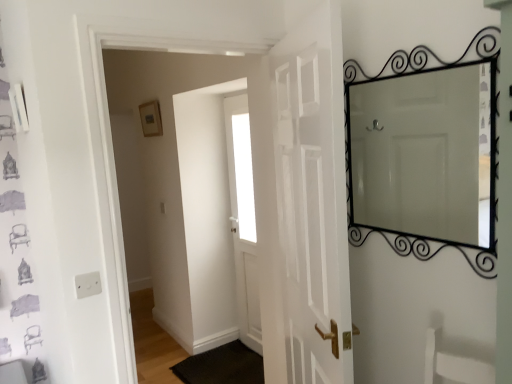
Image resolution: width=512 pixels, height=384 pixels. What do you see at coordinates (243, 219) in the screenshot? I see `white matte door at center, arranged as the 2th door when viewed from the front` at bounding box center [243, 219].

Measure the distance between point [469,153] and camera.

The depth of point [469,153] is 1.65 meters.

The width and height of the screenshot is (512, 384). I want to click on black rubber doormat at lower center, so click(x=222, y=366).

What's the angular difference between matte gold picture frame at upper center and black wrought iron mirror at upper right's facing directions?

0.0639 degrees.

Is matte gold picture frame at upper center next to black wrought iron mirror at upper right and touching it?

matte gold picture frame at upper center is not next to black wrought iron mirror at upper right, and they're not touching.

In the scene shown: Does matte gold picture frame at upper center turn towards black wrought iron mirror at upper right?

No, matte gold picture frame at upper center is not aimed at black wrought iron mirror at upper right.

The image size is (512, 384). Find the location of `picture frame above the black wrought iron mirror at upper right (from a real-world perspective)`. picture frame above the black wrought iron mirror at upper right (from a real-world perspective) is located at coordinates [151, 119].

Could you tell me if black rubber doormat at lower center is turned towards white glossy door at center, the first door in the front-to-back sequence?

No, black rubber doormat at lower center is not turned towards white glossy door at center, the first door in the front-to-back sequence.

In terms of width, does black rubber doormat at lower center look wider or thinner when compared to white glossy door at center, positioned as the second door in back-to-front order?

black rubber doormat at lower center is wider than white glossy door at center, positioned as the second door in back-to-front order.

Does black rubber doormat at lower center have a lesser height compared to white glossy door at center, positioned as the second door in back-to-front order?

Indeed, black rubber doormat at lower center has a lesser height compared to white glossy door at center, positioned as the second door in back-to-front order.

Do you think white matte door at center, arranged as the 2th door when viewed from the front, is within white glossy door at center, the first door in the front-to-back sequence, or outside of it?

white matte door at center, arranged as the 2th door when viewed from the front, is located beyond the bounds of white glossy door at center, the first door in the front-to-back sequence.

Considering the sizes of white matte door at center, the first door in the back-to-front sequence, and white glossy door at center, the first door in the front-to-back sequence, in the image, is white matte door at center, the first door in the back-to-front sequence, taller or shorter than white glossy door at center, the first door in the front-to-back sequence,?

Clearly, white matte door at center, the first door in the back-to-front sequence, is taller compared to white glossy door at center, the first door in the front-to-back sequence.

Does point (236, 110) come in front of point (331, 236)?

No, (236, 110) is further to viewer.

Is black wrought iron mirror at upper right far away from white matte door at center, arranged as the 2th door when viewed from the front?

black wrought iron mirror at upper right is far away from white matte door at center, arranged as the 2th door when viewed from the front.

Consider the image. Considering the sizes of black wrought iron mirror at upper right and white matte door at center, the first door in the back-to-front sequence, in the image, is black wrought iron mirror at upper right bigger or smaller than white matte door at center, the first door in the back-to-front sequence,?

black wrought iron mirror at upper right is smaller than white matte door at center, the first door in the back-to-front sequence.

Based on the photo, would you say black wrought iron mirror at upper right contains white matte door at center, the first door in the back-to-front sequence?

Actually, white matte door at center, the first door in the back-to-front sequence, is outside black wrought iron mirror at upper right.

Is black wrought iron mirror at upper right thinner than white matte door at center, the first door in the back-to-front sequence?

Yes.

From the image's perspective, does black rubber doormat at lower center appear lower than matte gold picture frame at upper center?

Yes, from the image's perspective, black rubber doormat at lower center is beneath matte gold picture frame at upper center.

Is matte gold picture frame at upper center at the back of black rubber doormat at lower center?

No, black rubber doormat at lower center's orientation is not away from matte gold picture frame at upper center.

Is black rubber doormat at lower center not within matte gold picture frame at upper center?

Yes, black rubber doormat at lower center is not within matte gold picture frame at upper center.

Can you confirm if black rubber doormat at lower center is bigger than matte gold picture frame at upper center?

Indeed, black rubber doormat at lower center has a larger size compared to matte gold picture frame at upper center.

From the image's perspective, which one is positioned higher, matte gold picture frame at upper center or white matte door at center, the first door in the back-to-front sequence?

matte gold picture frame at upper center, from the image's perspective.

Is matte gold picture frame at upper center facing away from white matte door at center, arranged as the 2th door when viewed from the front?

No, matte gold picture frame at upper center is not facing the opposite direction of white matte door at center, arranged as the 2th door when viewed from the front.

From a real-world perspective, is matte gold picture frame at upper center over white matte door at center, the first door in the back-to-front sequence?

Yes.

Is point (317, 97) farther from viewer compared to point (259, 308)?

No, it is not.

Considering the relative sizes of white glossy door at center, positioned as the second door in back-to-front order, and white matte door at center, arranged as the 2th door when viewed from the front, in the image provided, is white glossy door at center, positioned as the second door in back-to-front order, bigger than white matte door at center, arranged as the 2th door when viewed from the front,?

Correct, white glossy door at center, positioned as the second door in back-to-front order, is larger in size than white matte door at center, arranged as the 2th door when viewed from the front.

Is white glossy door at center, the first door in the front-to-back sequence, far from white matte door at center, arranged as the 2th door when viewed from the front?

That's right, there is a large distance between white glossy door at center, the first door in the front-to-back sequence, and white matte door at center, arranged as the 2th door when viewed from the front.

What's the angular difference between white glossy door at center, the first door in the front-to-back sequence, and white matte door at center, arranged as the 2th door when viewed from the front,'s facing directions?

25.2 degrees separate the facing orientations of white glossy door at center, the first door in the front-to-back sequence, and white matte door at center, arranged as the 2th door when viewed from the front.

Where is `picture frame that appears above the black wrought iron mirror at upper right (from the image's perspective)`? The image size is (512, 384). picture frame that appears above the black wrought iron mirror at upper right (from the image's perspective) is located at coordinates (151, 119).

At what (x,y) coordinates should I click in order to perform the action: click on the 2nd door counting from the right side of the black rubber doormat at lower center. Please return your answer as a coordinate pair (x, y). Looking at the image, I should click on (306, 208).

From the image, which object appears to be nearer to white matte door at center, the first door in the back-to-front sequence, matte gold picture frame at upper center or white glossy door at center, the first door in the front-to-back sequence?

matte gold picture frame at upper center is closer to white matte door at center, the first door in the back-to-front sequence.

Considering their positions, is matte gold picture frame at upper center positioned closer to white matte door at center, arranged as the 2th door when viewed from the front, than black wrought iron mirror at upper right?

matte gold picture frame at upper center.

From the image, which object appears to be nearer to white matte door at center, arranged as the 2th door when viewed from the front, black wrought iron mirror at upper right or white glossy door at center, the first door in the front-to-back sequence?

white glossy door at center, the first door in the front-to-back sequence.

From the image, which object appears to be nearer to matte gold picture frame at upper center, black wrought iron mirror at upper right or white glossy door at center, the first door in the front-to-back sequence?

Based on the image, white glossy door at center, the first door in the front-to-back sequence, appears to be nearer to matte gold picture frame at upper center.

Which object lies further to the anchor point black wrought iron mirror at upper right, black rubber doormat at lower center or white matte door at center, the first door in the back-to-front sequence?

black rubber doormat at lower center is further to black wrought iron mirror at upper right.

From the image, which object appears to be farther from black rubber doormat at lower center, black wrought iron mirror at upper right or matte gold picture frame at upper center?

black wrought iron mirror at upper right is further to black rubber doormat at lower center.

From the image, which object appears to be farther from white glossy door at center, positioned as the second door in back-to-front order, black wrought iron mirror at upper right or matte gold picture frame at upper center?

Among the two, matte gold picture frame at upper center is located further to white glossy door at center, positioned as the second door in back-to-front order.

When comparing their distances from white glossy door at center, the first door in the front-to-back sequence, does white matte door at center, the first door in the back-to-front sequence, or matte gold picture frame at upper center seem closer?

The object closer to white glossy door at center, the first door in the front-to-back sequence, is white matte door at center, the first door in the back-to-front sequence.

Where is `doormat between black wrought iron mirror at upper right and white matte door at center, arranged as the 2th door when viewed from the front, along the z-axis`? doormat between black wrought iron mirror at upper right and white matte door at center, arranged as the 2th door when viewed from the front, along the z-axis is located at coordinates (222, 366).

At what (x,y) coordinates should I click in order to perform the action: click on mirror between white glossy door at center, positioned as the second door in back-to-front order, and black rubber doormat at lower center, along the z-axis. Please return your answer as a coordinate pair (x, y). This screenshot has height=384, width=512. Looking at the image, I should click on (425, 154).

Locate an element on the screen. mirror between white glossy door at center, positioned as the second door in back-to-front order, and matte gold picture frame at upper center in the front-back direction is located at coordinates (425, 154).

Locate an element on the screen. This screenshot has height=384, width=512. door between white glossy door at center, the first door in the front-to-back sequence, and matte gold picture frame at upper center, along the z-axis is located at coordinates (243, 219).